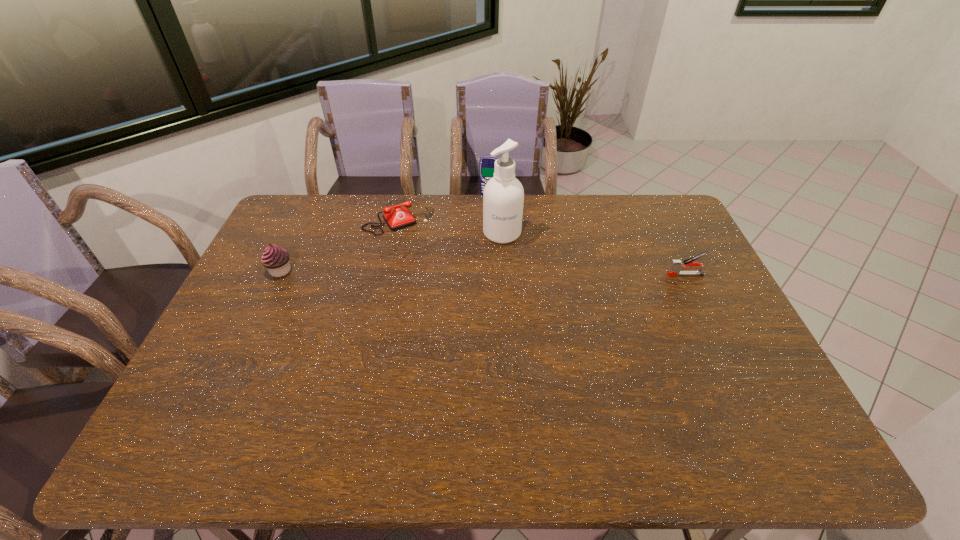
The image size is (960, 540). I want to click on the second closest object relative to the rightmost object, so tap(486, 166).

Locate which object ranks second in proximity to the third tallest object. Please provide its 2D coordinates. Your answer should be formatted as a tuple, i.e. [(x, y)], where the tuple contains the x and y coordinates of a point satisfying the conditions above.

[(503, 197)]

At what (x,y) coordinates should I click in order to perform the action: click on vacant space that satisfies the following two spatial constraints: 1. on the front side of the cleansing agent; 2. on the handle side of the rightmost object. Please return your answer as a coordinate pair (x, y). The width and height of the screenshot is (960, 540). Looking at the image, I should click on (504, 274).

The height and width of the screenshot is (540, 960). What are the coordinates of `vacant area in the image that satisfies the following two spatial constraints: 1. on the back side of the shortest object; 2. on the left side of the second tallest object` in the screenshot? It's located at (404, 195).

Identify the location of vacant area in the image that satisfies the following two spatial constraints: 1. on the front side of the cleansing agent; 2. on the handle side of the stapler. The height and width of the screenshot is (540, 960). (504, 274).